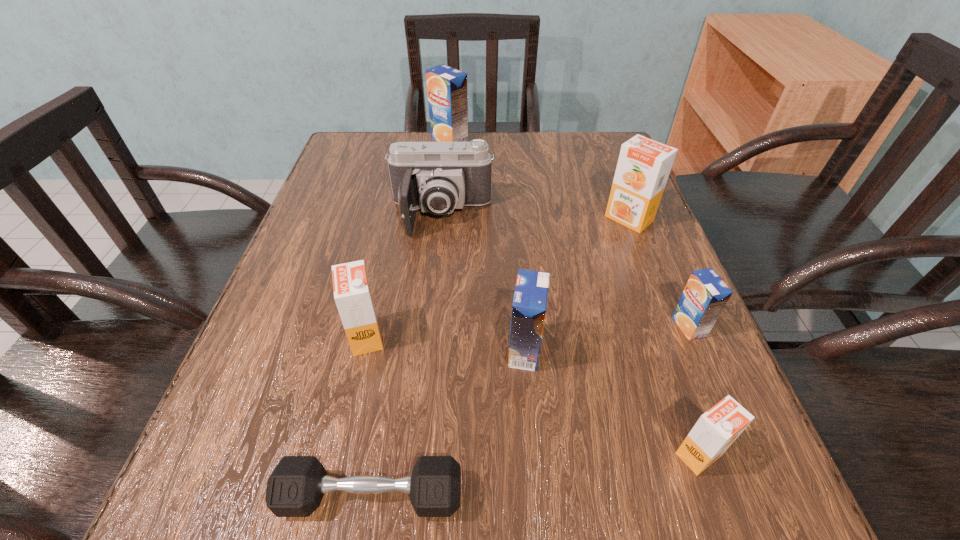
You are a GUI agent. You are given a task and a screenshot of the screen. Output one action in this format:
    pyautogui.click(x=<x>, y=<y>)
    Task: Click on the vacant region between the farthest orange_juice and the fifth object from left to right
    
    Given the screenshot: What is the action you would take?
    pyautogui.click(x=487, y=245)

What are the coordinates of `object that is the second nearest to the shortest object` in the screenshot? It's located at (352, 292).

Where is `object that stands as the sixth closest to the camera`? The image size is (960, 540). object that stands as the sixth closest to the camera is located at coordinates (295, 488).

Identify which orange_juice is located as the third nearest to the farthest blue orange_juice. Please provide its 2D coordinates. Your answer should be formatted as a tuple, i.e. [(x, y)], where the tuple contains the x and y coordinates of a point satisfying the conditions above.

[(529, 305)]

Image resolution: width=960 pixels, height=540 pixels. In order to click on orange_juice object that ranks as the fifth closest to the farthest orange orange juice in this screenshot , I will do `click(352, 292)`.

Identify which blue orange_juice is located as the second nearest to the second farthest orange orange juice. Please provide its 2D coordinates. Your answer should be formatted as a tuple, i.e. [(x, y)], where the tuple contains the x and y coordinates of a point satisfying the conditions above.

[(705, 295)]

I want to click on blue orange_juice that stands as the closest to the camera, so click(x=447, y=87).

Identify which orange orange juice is the closest to the second biggest orange orange juice. Please provide its 2D coordinates. Your answer should be formatted as a tuple, i.e. [(x, y)], where the tuple contains the x and y coordinates of a point satisfying the conditions above.

[(715, 431)]

Locate which orange orange juice ranks third in proximity to the second biggest blue orange_juice. Please provide its 2D coordinates. Your answer should be formatted as a tuple, i.e. [(x, y)], where the tuple contains the x and y coordinates of a point satisfying the conditions above.

[(644, 165)]

At what (x,y) coordinates should I click in order to perform the action: click on free space that satisfies the following two spatial constraints: 1. on the back side of the nearest orange_juice; 2. on the left side of the farthest orange orange juice. Please return your answer as a coordinate pair (x, y). Image resolution: width=960 pixels, height=540 pixels. Looking at the image, I should click on (615, 219).